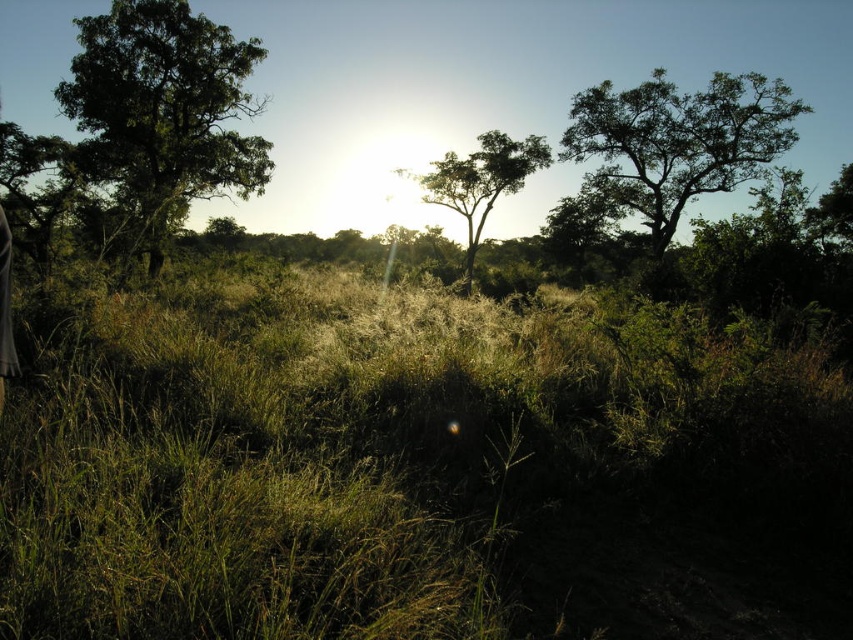
Does green leafy tree at upper right appear over green leafy tree at center?

Correct, green leafy tree at upper right is located above green leafy tree at center.

Is green leafy tree at upper right in front of green leafy tree at center?

No, green leafy tree at upper right is further to the viewer.

Does point (689, 180) come behind point (431, 196)?

No, (689, 180) is in front of (431, 196).

Where is `green leafy tree at upper right`? This screenshot has width=853, height=640. green leafy tree at upper right is located at coordinates (676, 141).

Between point (693, 484) and point (544, 157), which one is positioned behind?

Positioned behind is point (544, 157).

Who is more forward, (22,481) or (445,179)?

Point (22,481) is in front.

Does point (250, 598) lie in front of point (424, 186)?

Yes, it is in front of point (424, 186).

I want to click on green grass at center, so click(x=409, y=472).

Identify the location of green leafy tree at upper left. The image size is (853, 640). click(164, 109).

Consider the image. Can you confirm if green leafy tree at upper left is positioned to the left of green leafy tree at center?

Yes, green leafy tree at upper left is to the left of green leafy tree at center.

Between point (148, 182) and point (430, 163), which one is positioned behind?

The point (430, 163) is more distant.

The height and width of the screenshot is (640, 853). I want to click on green leafy tree at upper left, so click(164, 109).